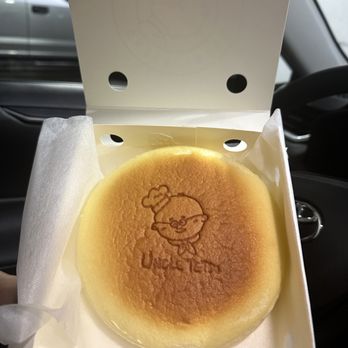
Locate an element on the screen. The height and width of the screenshot is (348, 348). tissue is located at coordinates (38, 189).